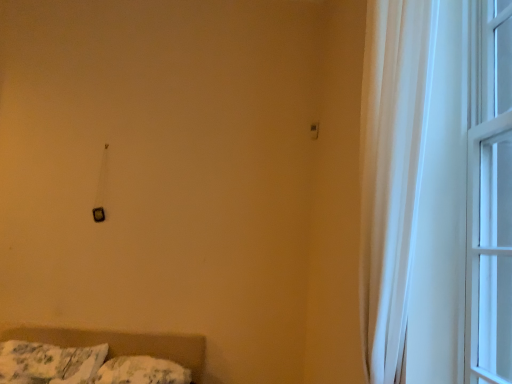
Question: From the image's perspective, is fluffy white pillow at lower left, the 2th pillow from the left, on fluffy white pillow at lower left, which is the second pillow in right-to-left order?

Choices:
 (A) no
 (B) yes

Answer: (A)

Question: Does fluffy white pillow at lower left, the 2th pillow from the left, come in front of fluffy white pillow at lower left, placed as the first pillow when sorted from left to right?

Choices:
 (A) no
 (B) yes

Answer: (A)

Question: Does fluffy white pillow at lower left, the 2th pillow from the left, turn towards fluffy white pillow at lower left, placed as the first pillow when sorted from left to right?

Choices:
 (A) yes
 (B) no

Answer: (B)

Question: Can you confirm if fluffy white pillow at lower left, placed as the first pillow when sorted from right to left, is positioned to the right of fluffy white pillow at lower left, placed as the first pillow when sorted from left to right?

Choices:
 (A) yes
 (B) no

Answer: (A)

Question: Is the surface of fluffy white pillow at lower left, placed as the first pillow when sorted from right to left, in direct contact with fluffy white pillow at lower left, placed as the first pillow when sorted from left to right?

Choices:
 (A) no
 (B) yes

Answer: (A)

Question: Does fluffy white pillow at lower left, the 2th pillow from the left, have a greater width compared to fluffy white pillow at lower left, placed as the first pillow when sorted from left to right?

Choices:
 (A) no
 (B) yes

Answer: (A)

Question: Does white glass window at right, the first window in the right-to-left sequence, have a larger size compared to matte black switch at upper center?

Choices:
 (A) no
 (B) yes

Answer: (B)

Question: Considering the relative sizes of white glass window at right, the first window in the right-to-left sequence, and matte black switch at upper center in the image provided, is white glass window at right, the first window in the right-to-left sequence, thinner than matte black switch at upper center?

Choices:
 (A) yes
 (B) no

Answer: (B)

Question: Are white glass window at right, the first window in the right-to-left sequence, and matte black switch at upper center far apart?

Choices:
 (A) no
 (B) yes

Answer: (B)

Question: Is the surface of white glass window at right, the first window in the right-to-left sequence, in direct contact with matte black switch at upper center?

Choices:
 (A) no
 (B) yes

Answer: (A)

Question: Does white glass window at right, the first window in the right-to-left sequence, have a greater height compared to matte black switch at upper center?

Choices:
 (A) yes
 (B) no

Answer: (A)

Question: Does white glass window at right, which is the second window from left to right, turn towards matte black switch at upper center?

Choices:
 (A) yes
 (B) no

Answer: (B)

Question: From a real-world perspective, is fluffy white pillow at lower left, placed as the first pillow when sorted from left to right, located higher than fluffy white pillow at lower left, the 2th pillow from the left?

Choices:
 (A) no
 (B) yes

Answer: (B)